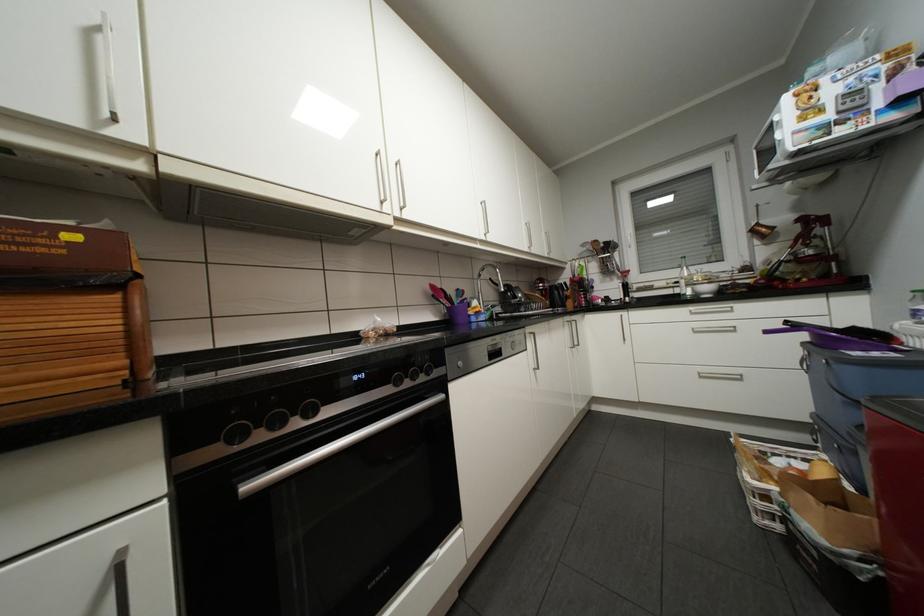
This screenshot has height=616, width=924. What do you see at coordinates (332, 448) in the screenshot? I see `the oven door handle` at bounding box center [332, 448].